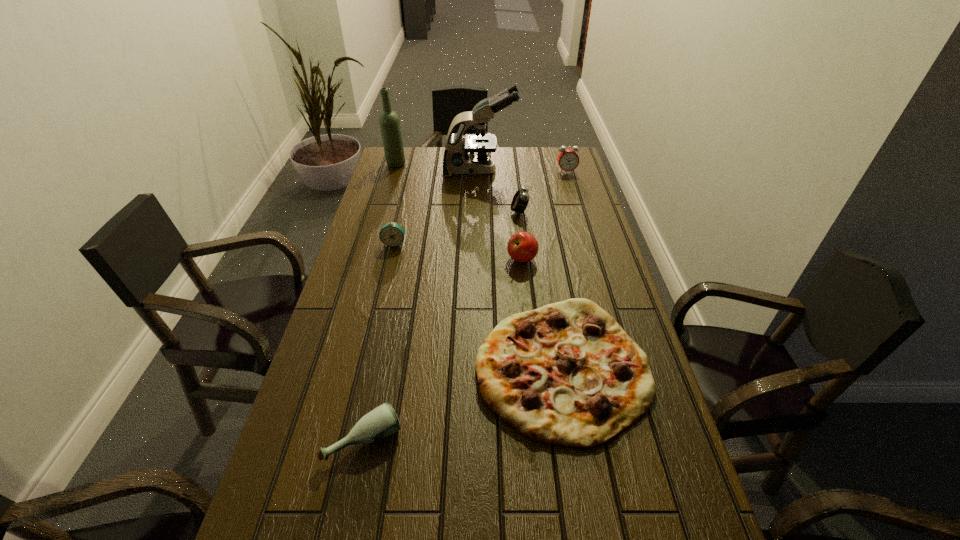
Find the location of a particular element. The width and height of the screenshot is (960, 540). microscope at the far edge is located at coordinates (456, 160).

Find the location of a particular element. wine bottle that is at the far edge is located at coordinates (389, 122).

Identify the location of alarm clock that is at the far edge. This screenshot has height=540, width=960. (568, 160).

At what (x,y) coordinates should I click in order to perform the action: click on wine bottle located in the left edge section of the desktop. Please return your answer as a coordinate pair (x, y). Image resolution: width=960 pixels, height=540 pixels. Looking at the image, I should click on (389, 122).

I want to click on alarm clock located in the left edge section of the desktop, so click(392, 234).

Where is `bottle that is at the left edge`? The image size is (960, 540). bottle that is at the left edge is located at coordinates (381, 422).

You are a GUI agent. You are given a task and a screenshot of the screen. Output one action in this format:
    pyautogui.click(x=<x>, y=<y>)
    Task: Click on the alarm clock at the right edge
    The image size is (960, 540).
    Given the screenshot: What is the action you would take?
    pyautogui.click(x=568, y=160)

Where is `pizza located in the right edge section of the desktop`? pizza located in the right edge section of the desktop is located at coordinates (566, 374).

Find the location of `object positioned at the far left corner`. object positioned at the far left corner is located at coordinates (389, 122).

The image size is (960, 540). I want to click on object positioned at the far right corner, so click(x=568, y=160).